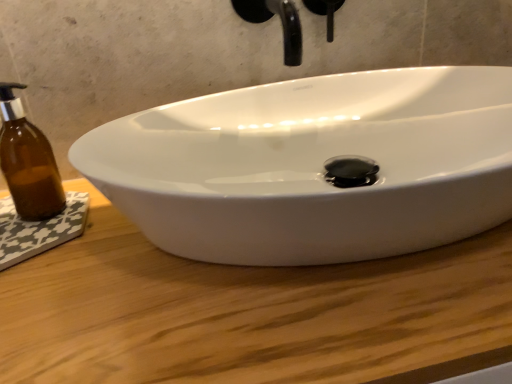
Question: Is brown glass bottle at left completely or partially outside of wooden at center?

Choices:
 (A) no
 (B) yes

Answer: (B)

Question: Considering the relative sizes of brown glass bottle at left and wooden at center in the image provided, is brown glass bottle at left wider than wooden at center?

Choices:
 (A) no
 (B) yes

Answer: (A)

Question: Can you confirm if brown glass bottle at left is positioned to the right of wooden at center?

Choices:
 (A) yes
 (B) no

Answer: (B)

Question: Can you confirm if brown glass bottle at left is smaller than wooden at center?

Choices:
 (A) no
 (B) yes

Answer: (B)

Question: Is brown glass bottle at left facing away from wooden at center?

Choices:
 (A) no
 (B) yes

Answer: (A)

Question: Does point (44, 155) appear closer or farther from the camera than point (292, 6)?

Choices:
 (A) farther
 (B) closer

Answer: (A)

Question: From a real-world perspective, is brown glass bottle at left physically located above or below black matte faucet at upper center?

Choices:
 (A) above
 (B) below

Answer: (B)

Question: Do you think brown glass bottle at left is within black matte faucet at upper center, or outside of it?

Choices:
 (A) inside
 (B) outside

Answer: (B)

Question: Looking at their shapes, would you say brown glass bottle at left is wider or thinner than black matte faucet at upper center?

Choices:
 (A) wide
 (B) thin

Answer: (B)

Question: Considering the relative positions of wooden at center and brown glass bottle at left in the image provided, is wooden at center to the left or to the right of brown glass bottle at left?

Choices:
 (A) right
 (B) left

Answer: (A)

Question: Does point (179, 365) appear closer or farther from the camera than point (41, 145)?

Choices:
 (A) farther
 (B) closer

Answer: (B)

Question: From their relative heights in the image, would you say wooden at center is taller or shorter than brown glass bottle at left?

Choices:
 (A) short
 (B) tall

Answer: (B)

Question: Is wooden at center in front of or behind brown glass bottle at left in the image?

Choices:
 (A) front
 (B) behind

Answer: (A)

Question: Choose the correct answer: Is black matte faucet at upper center inside wooden at center or outside it?

Choices:
 (A) outside
 (B) inside

Answer: (A)

Question: From the image's perspective, relative to wooden at center, is black matte faucet at upper center above or below?

Choices:
 (A) below
 (B) above

Answer: (B)